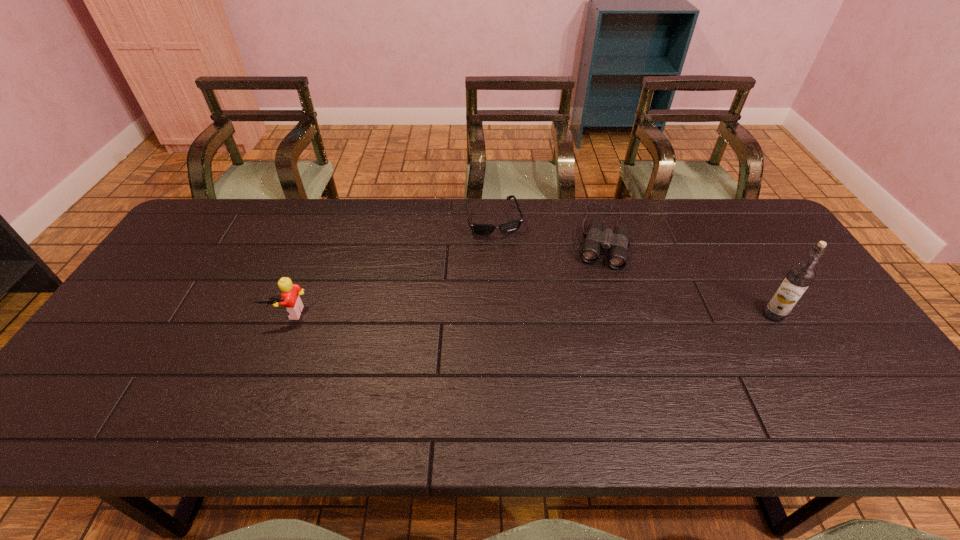
This screenshot has width=960, height=540. In order to click on free space on the desktop that is between the leftmost object and the vodka and is positioned on the front-facing side of the sunglasses in this screenshot , I will do `click(520, 314)`.

Locate an element on the screen. free space on the desktop that is between the Lego and the tallest object and is positioned at the eyepiece of the second object from right to left is located at coordinates (586, 314).